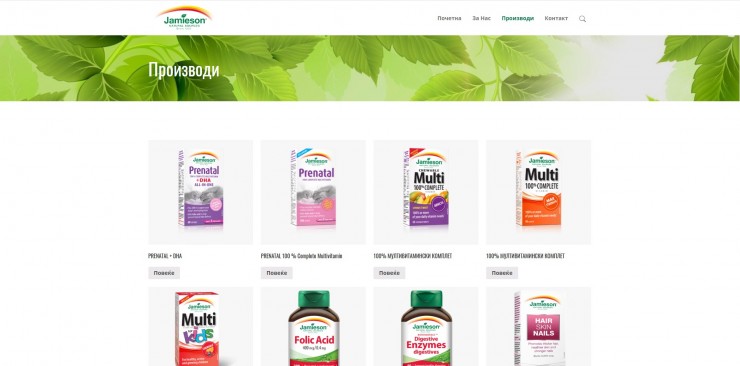
Where is `boxes`? The image size is (740, 366). boxes is located at coordinates (209, 177), (326, 195), (436, 197), (212, 322).